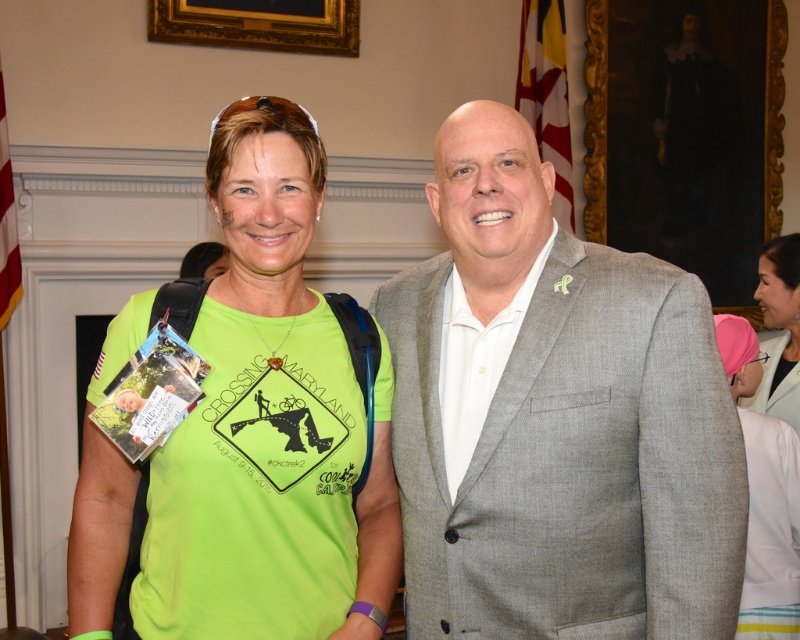
You are at a formal event and need to take a photo with the gray textured suit at center and the pink fabric at upper right. Which object should you focus on first to ensure both are in the frame?

The gray textured suit at center is in front of the pink fabric at upper right, so you should focus on the gray textured suit at center first to ensure both are in the frame.

You are at a formal event and see a person wearing a neon green t shirt with a bicycle graphic. The t shirt is represented by the point (x=270, y=424). What is the location of the neon green t shirt in the image?

The neon green t shirt at center is represented by point (x=270, y=424).